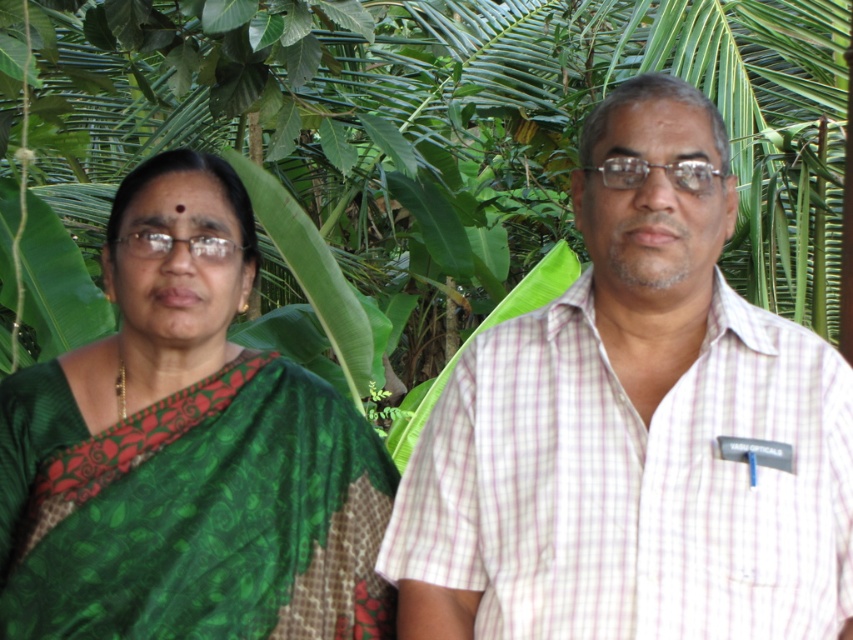
Question: Which object appears closest to the camera in this image?

Choices:
 (A) green woven saree at left
 (B) white checkered shirt at right

Answer: (B)

Question: Is white checkered shirt at right bigger than green woven saree at left?

Choices:
 (A) yes
 (B) no

Answer: (B)

Question: Is white checkered shirt at right smaller than green woven saree at left?

Choices:
 (A) no
 (B) yes

Answer: (B)

Question: Among these objects, which one is nearest to the camera?

Choices:
 (A) green woven saree at left
 (B) white checkered shirt at right

Answer: (B)

Question: Can you confirm if white checkered shirt at right is positioned to the left of green woven saree at left?

Choices:
 (A) yes
 (B) no

Answer: (B)